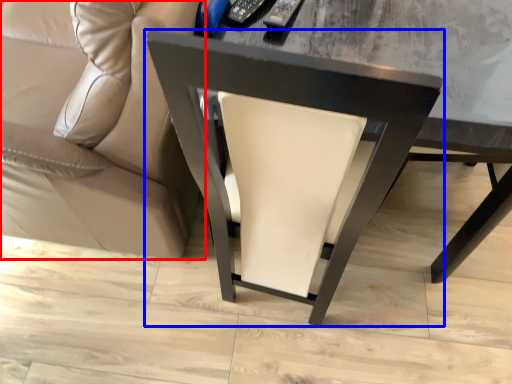
Question: Which point is closer to the camera, studio couch (highlighted by a red box) or chair (highlighted by a blue box)?

Choices:
 (A) studio couch
 (B) chair

Answer: (A)